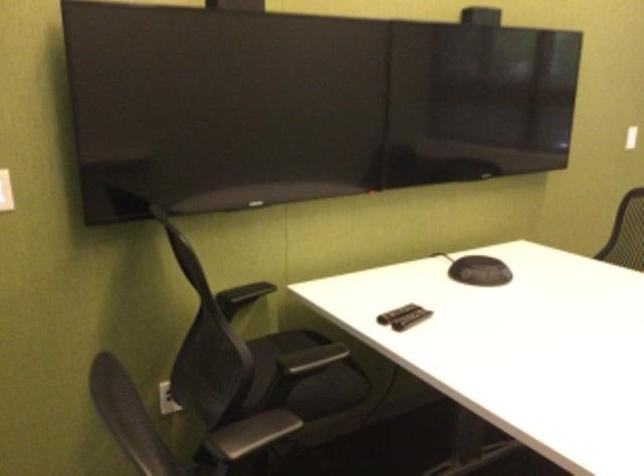
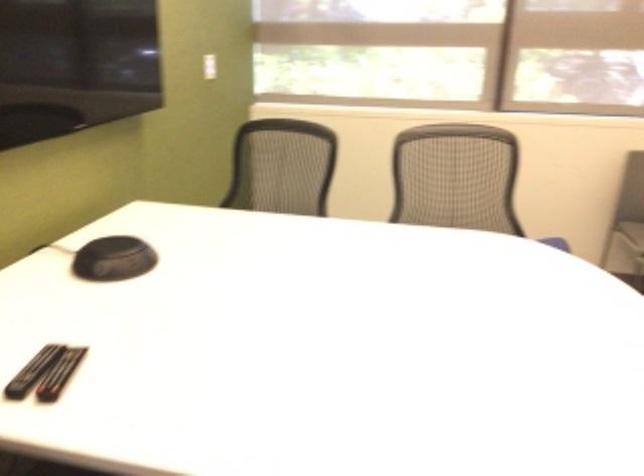
In the second image, find the point that corresponds to [408,319] in the first image.

(59, 374)